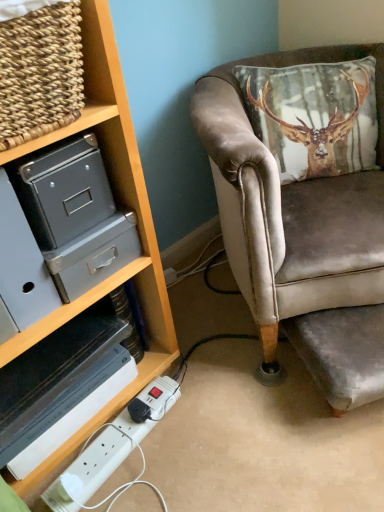
Question: Does point (92, 86) appear closer or farther from the camera than point (130, 419)?

Choices:
 (A) farther
 (B) closer

Answer: (B)

Question: Relative to white plastic extension cord at lower left, is woven wood basket at upper left in front or behind?

Choices:
 (A) behind
 (B) front

Answer: (B)

Question: Which of these objects is positioned closest to the woven wood basket at upper left?

Choices:
 (A) velvet brown chair at right
 (B) white plastic extension cord at lower left

Answer: (A)

Question: Which object is positioned farthest from the white plastic extension cord at lower left?

Choices:
 (A) woven wood basket at upper left
 (B) velvet brown chair at right

Answer: (A)